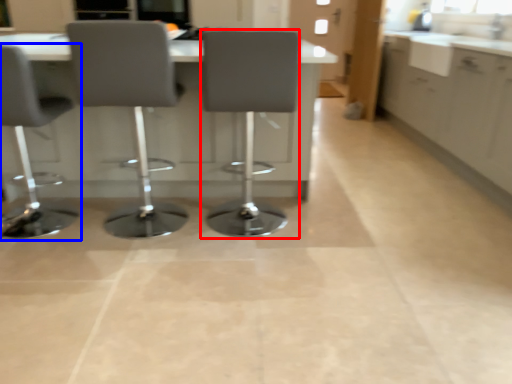
Question: Which of the following is the farthest to the observer, chair (highlighted by a red box) or chair (highlighted by a blue box)?

Choices:
 (A) chair
 (B) chair

Answer: (A)